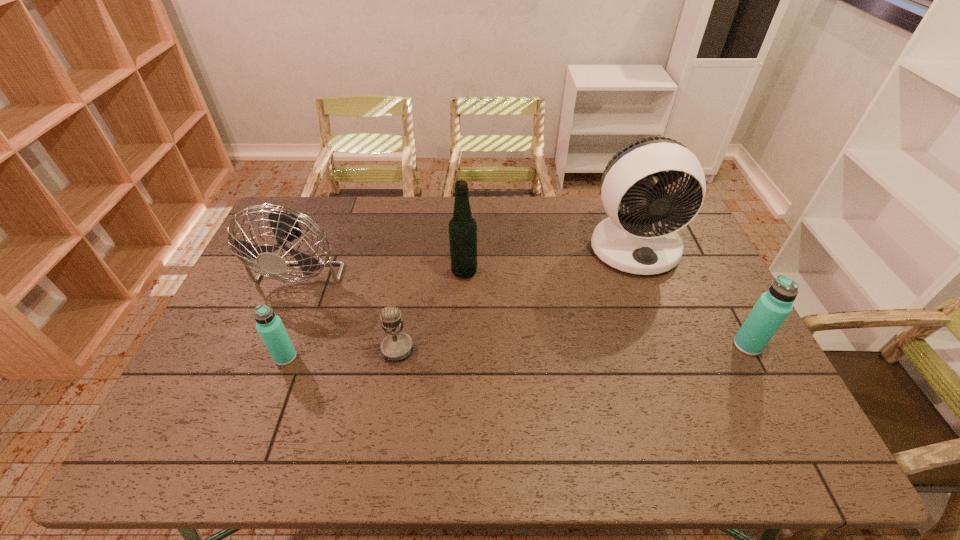
Identify the location of free point located 0.060m on the back of the rightmost object. (733, 318).

You are a GUI agent. You are given a task and a screenshot of the screen. Output one action in this format:
    pyautogui.click(x=<x>, y=<y>)
    Task: Click on the blank area located 0.370m on the back of the third object from right to left
    
    Given the screenshot: What is the action you would take?
    pyautogui.click(x=467, y=198)

Find the location of `vacant area situated 0.210m on the front-facing side of the left fan`. vacant area situated 0.210m on the front-facing side of the left fan is located at coordinates (265, 362).

The image size is (960, 540). I want to click on vacant space situated 0.120m on the grille of the right fan, so click(x=656, y=307).

Find the location of a particular element. vacant area situated on the front-facing side of the shortest object is located at coordinates (392, 387).

This screenshot has width=960, height=540. Find the location of `object that is at the left edge`. object that is at the left edge is located at coordinates (285, 226).

Where is `thermos bottle present at the right edge`? This screenshot has height=540, width=960. thermos bottle present at the right edge is located at coordinates [772, 308].

Find the location of `fan that is at the right edge`. fan that is at the right edge is located at coordinates (646, 242).

Image resolution: width=960 pixels, height=540 pixels. Identify the location of object at the far left corner. (285, 226).

Find the location of a particular element. object positioned at the far right corner is located at coordinates (646, 242).